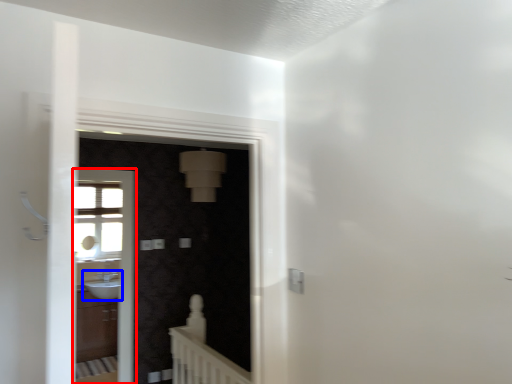
Question: Which point is further to the camera, screen door (highlighted by a red box) or sink (highlighted by a blue box)?

Choices:
 (A) screen door
 (B) sink

Answer: (B)